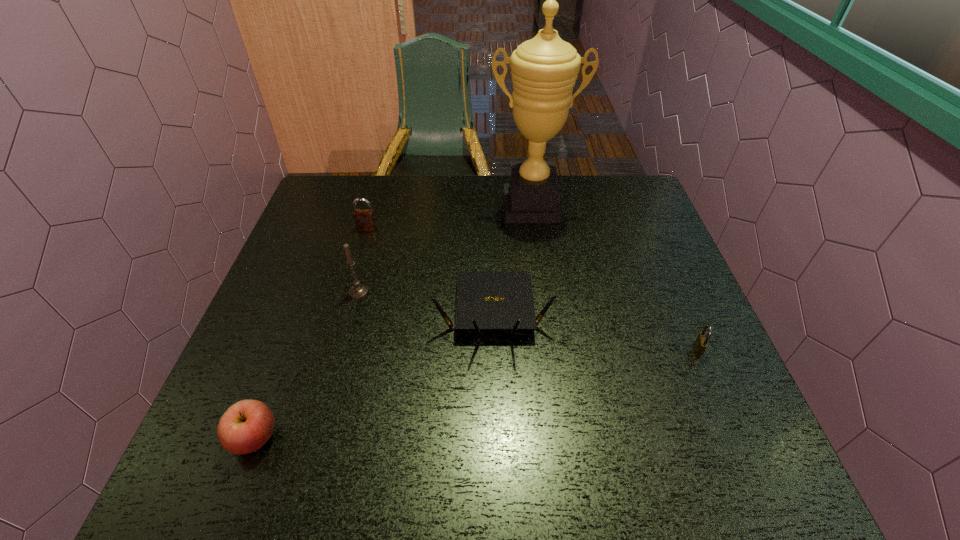
Where is `object that is at the near left corner`? This screenshot has height=540, width=960. object that is at the near left corner is located at coordinates (247, 425).

Locate an element on the screen. blank area at the far edge is located at coordinates (474, 180).

You are a GUI agent. You are given a task and a screenshot of the screen. Output one action in this format:
    pyautogui.click(x=<x>, y=<y>)
    Task: Click on the vacant position at the left edge of the desktop
    This screenshot has height=540, width=960.
    Given the screenshot: What is the action you would take?
    pyautogui.click(x=327, y=278)

I want to click on blank area at the right edge, so click(609, 242).

At what (x,y) coordinates should I click in order to perform the action: click on vacant space at the far left corner. Please return your answer as a coordinate pair (x, y). The width and height of the screenshot is (960, 540). Looking at the image, I should click on (345, 183).

Locate an element on the screen. This screenshot has height=540, width=960. vacant space at the far right corner is located at coordinates (630, 183).

The height and width of the screenshot is (540, 960). What are the coordinates of `vacant region between the farthest object and the second tallest object` in the screenshot? It's located at (444, 249).

At what (x,y) coordinates should I click in order to perform the action: click on unoccupied position between the apple and the farther padlock. Please return your answer as a coordinate pair (x, y). This screenshot has width=960, height=540. Looking at the image, I should click on [311, 333].

The image size is (960, 540). Find the location of `vacant region between the rightmost object and the router`. vacant region between the rightmost object and the router is located at coordinates (595, 331).

Find the location of `free spot between the fifth shortest object and the leftmost object`. free spot between the fifth shortest object and the leftmost object is located at coordinates (307, 364).